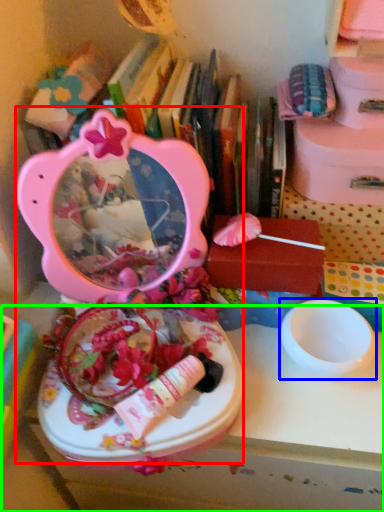
Question: Which is farther away from toy (highlighted by a red box)? bowl (highlighted by a blue box) or table (highlighted by a green box)?

Choices:
 (A) bowl
 (B) table

Answer: (A)